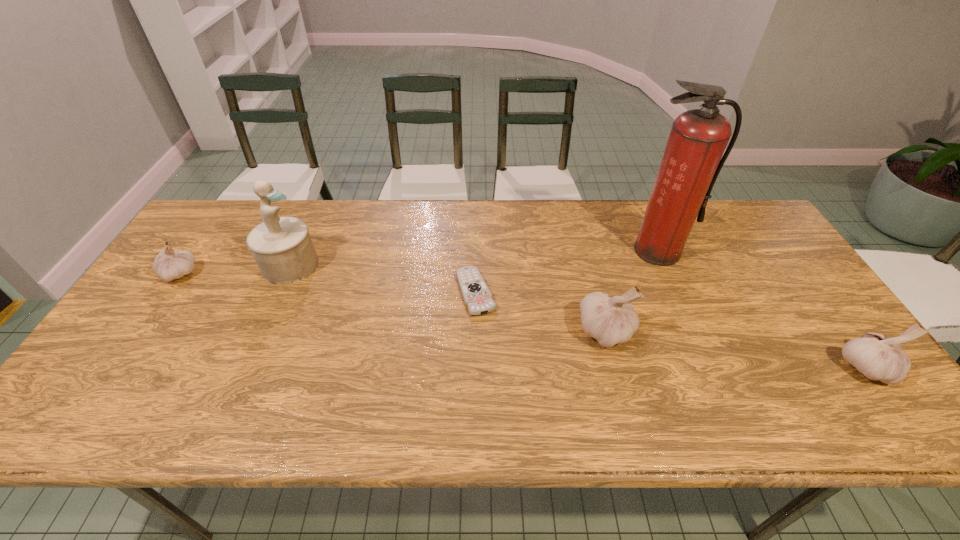
This screenshot has width=960, height=540. I want to click on unoccupied position between the second tallest object and the fifth object from left to right, so click(x=474, y=258).

I want to click on vacant area between the remote control and the leftmost object, so click(328, 283).

At what (x,y) coordinates should I click in order to perform the action: click on vacant space that is in between the second tallest garlic and the tallest object. Please return your answer as a coordinate pair (x, y). This screenshot has width=960, height=540. Looking at the image, I should click on (761, 309).

Find the location of a particular element. empty space between the fourth object from left to right and the figurine is located at coordinates (448, 299).

You are a GUI agent. You are given a task and a screenshot of the screen. Output one action in this format:
    pyautogui.click(x=<x>, y=<y>)
    Task: Click on the vacant area that lies between the leftmost garlic and the second tallest object
    
    Given the screenshot: What is the action you would take?
    pyautogui.click(x=235, y=269)

The height and width of the screenshot is (540, 960). In order to click on free space between the figurine and the second object from right to left in this screenshot , I will do `click(474, 258)`.

Locate an element on the screen. This screenshot has width=960, height=540. empty space that is in between the third object from right to left and the rightmost object is located at coordinates (735, 350).

Select which object is the fourth closest to the second garlic from right to left. Please provide its 2D coordinates. Your answer should be formatted as a tuple, i.e. [(x, y)], where the tuple contains the x and y coordinates of a point satisfying the conditions above.

[(282, 247)]

Where is `the fourth closest object relative to the leftmost garlic`? This screenshot has width=960, height=540. the fourth closest object relative to the leftmost garlic is located at coordinates (692, 160).

This screenshot has height=540, width=960. I want to click on garlic that stands as the second closest to the leftmost object, so click(x=877, y=357).